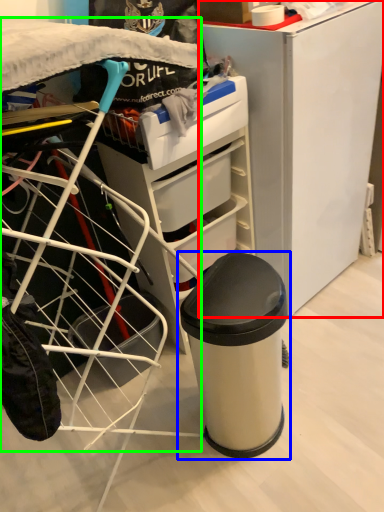
Question: Based on their relative distances, which object is nearer to furniture (highlighted by a red box)? Choose from waste container (highlighted by a blue box) and wide (highlighted by a green box).

Choices:
 (A) waste container
 (B) wide

Answer: (A)